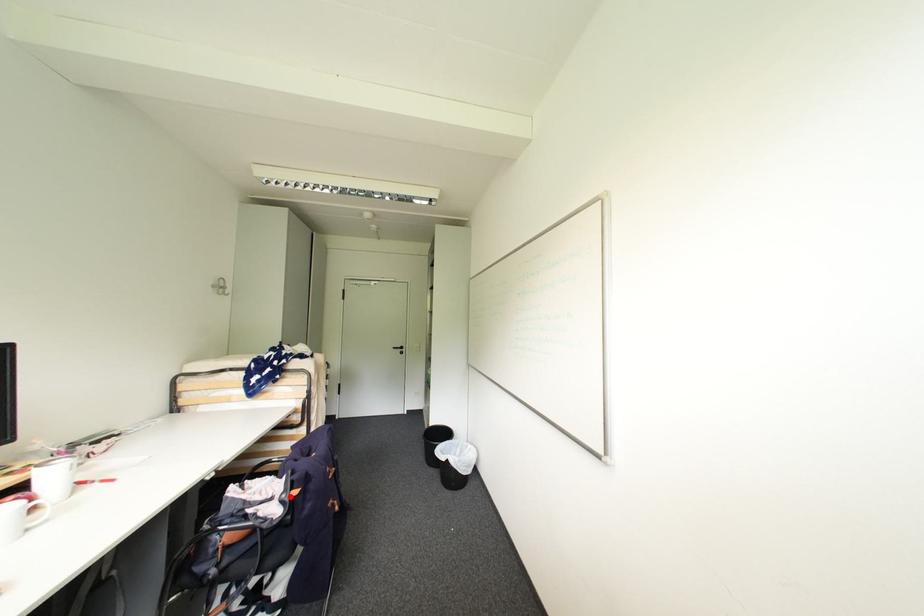
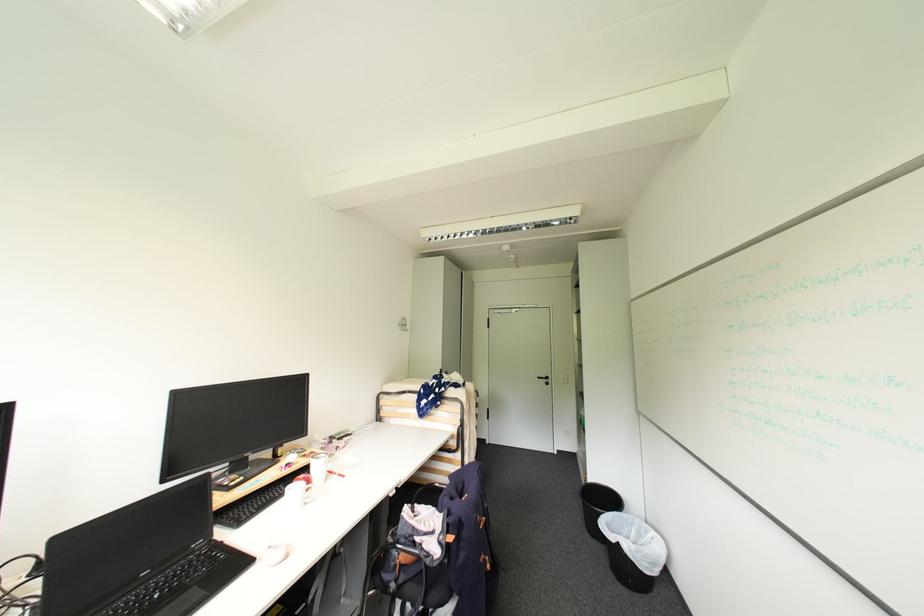
Where in the second image is the point corresponding to the highlighted location from the first image?

(447, 538)